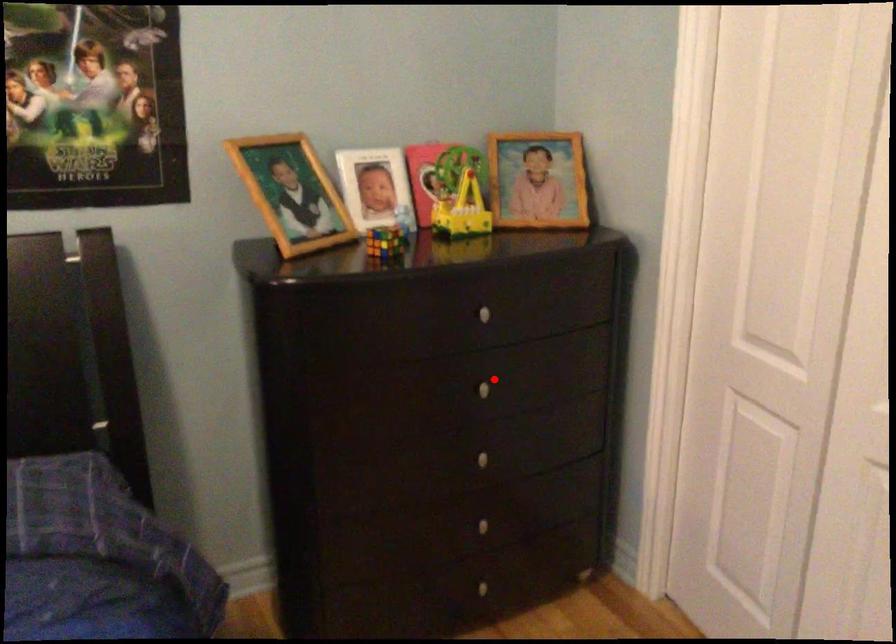
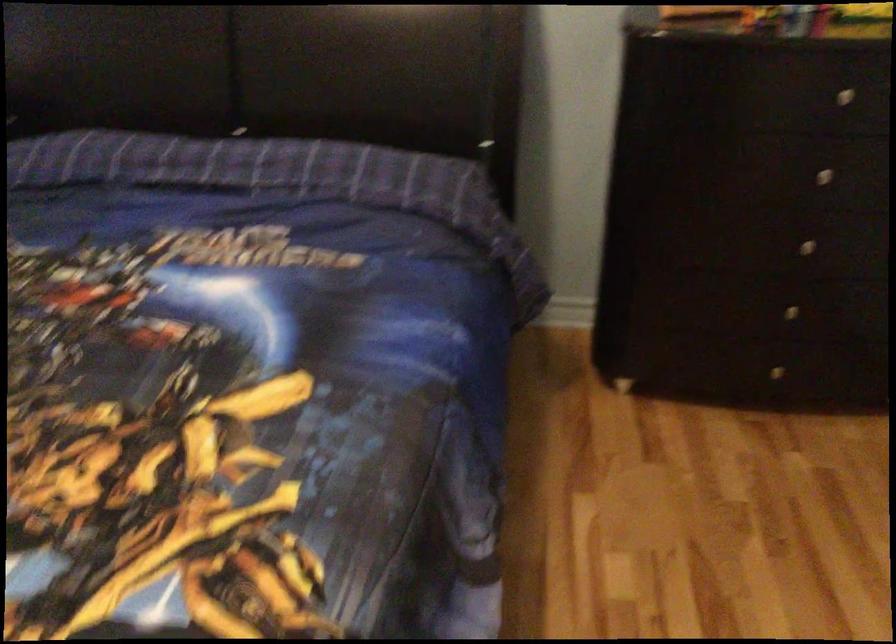
Where in the second image is the point corresponding to the highlighted location from the first image?

(833, 169)